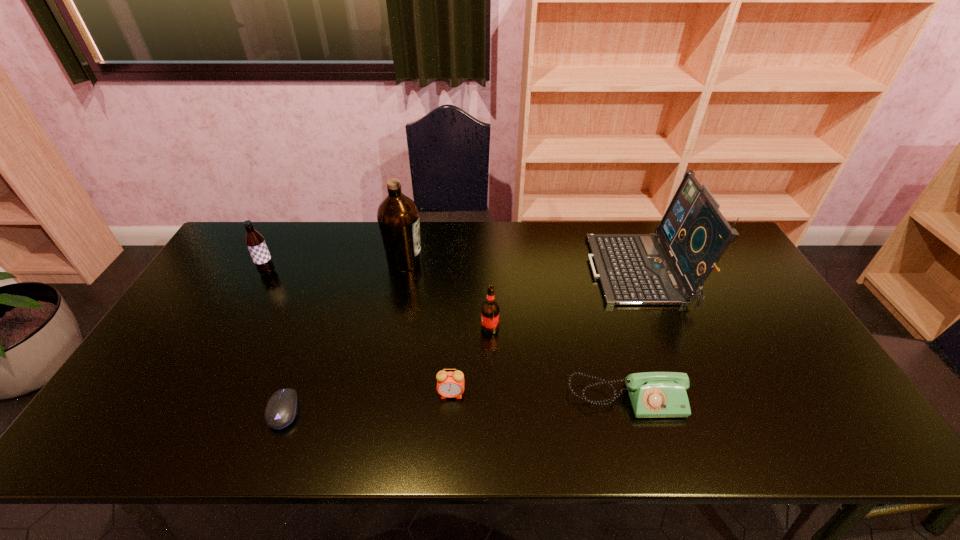
The image size is (960, 540). What are the coordinates of `laptop computer that is at the far edge` in the screenshot? It's located at (633, 269).

You are a GUI agent. You are given a task and a screenshot of the screen. Output one action in this format:
    pyautogui.click(x=<x>, y=<y>)
    Task: Click on the telephone that is at the near edge
    The image size is (960, 540).
    Given the screenshot: What is the action you would take?
    pyautogui.click(x=652, y=394)

This screenshot has width=960, height=540. Find the location of `computer mouse present at the near edge`. computer mouse present at the near edge is located at coordinates (282, 407).

What are the coordinates of `object situated at the left edge` in the screenshot? It's located at (255, 242).

Locate an element on the screen. The width and height of the screenshot is (960, 540). free point at the far edge is located at coordinates (377, 239).

In the image, there is a desktop. Where is `vacant region at the near edge`? This screenshot has height=540, width=960. vacant region at the near edge is located at coordinates (544, 422).

This screenshot has width=960, height=540. I want to click on free spot at the left edge of the desktop, so click(x=249, y=286).

Locate an element on the screen. This screenshot has height=540, width=960. free space at the right edge of the desktop is located at coordinates (759, 293).

What are the coordinates of `free spot between the second shortest object and the laptop computer` in the screenshot? It's located at (634, 335).

You are a GUI agent. You are given a task and a screenshot of the screen. Output one action in this format:
    pyautogui.click(x=<x>, y=<y>)
    Task: Click on the blank region between the laptop computer and the third shortest object
    
    Given the screenshot: What is the action you would take?
    pyautogui.click(x=546, y=333)